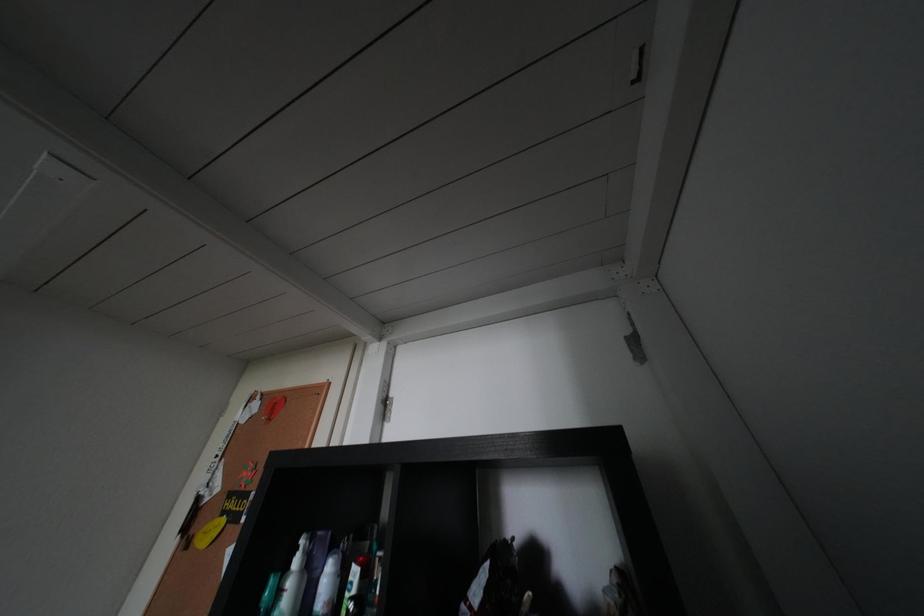
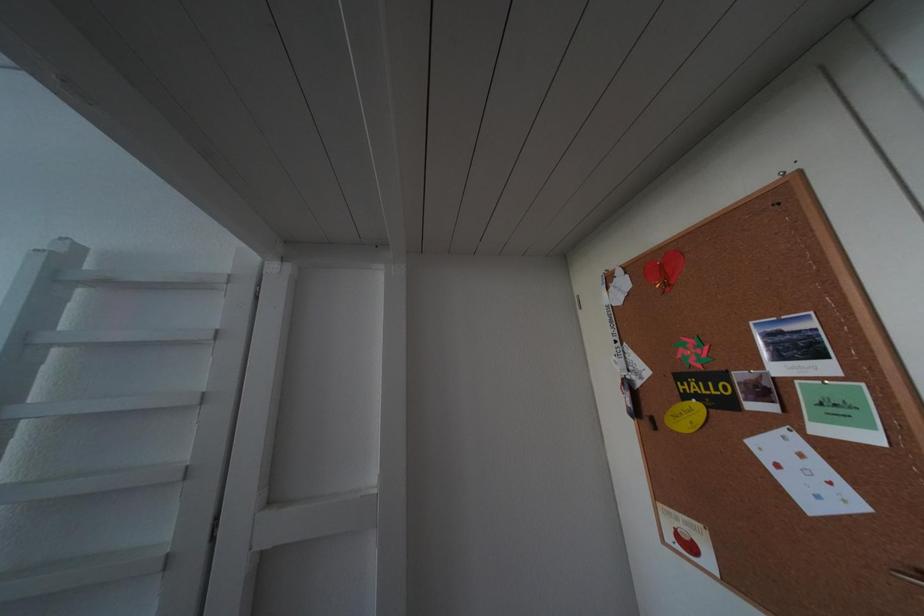
Question: The first image is from the beginning of the video and the second image is from the end. How did the camera likely rotate when shooting the video?

Choices:
 (A) Left
 (B) Right
 (C) Up
 (D) Down

Answer: (A)